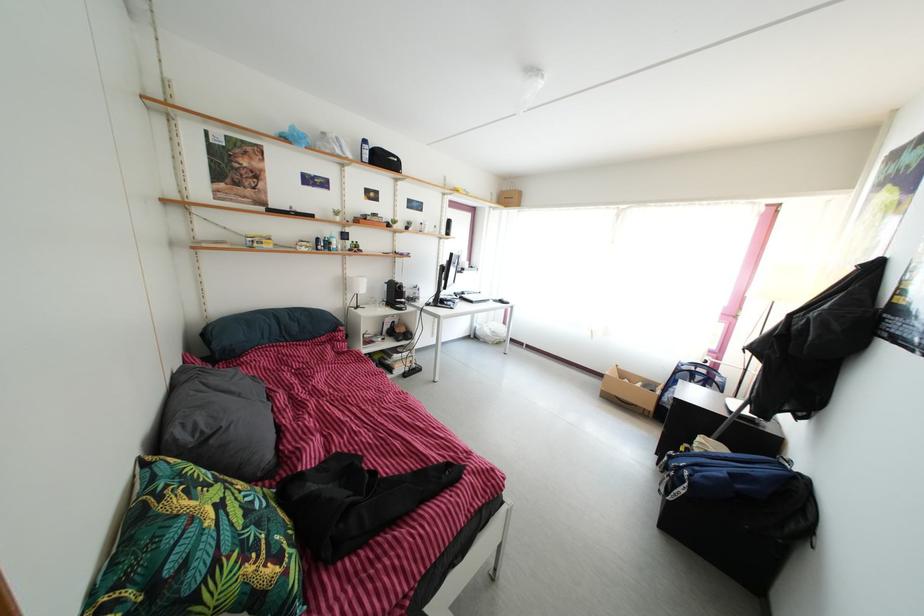
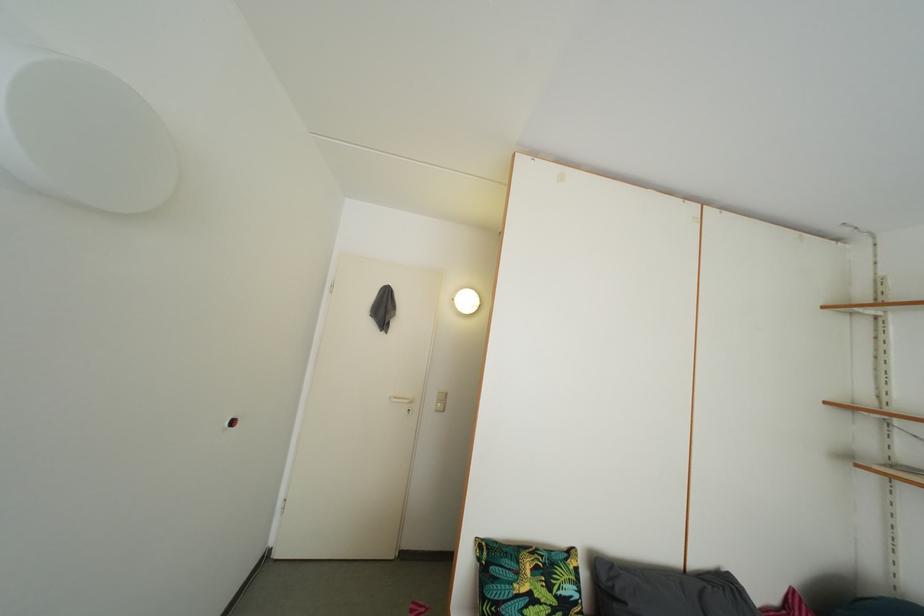
Find the pixel in the second image that matches (x=215, y=440) in the first image.

(624, 601)